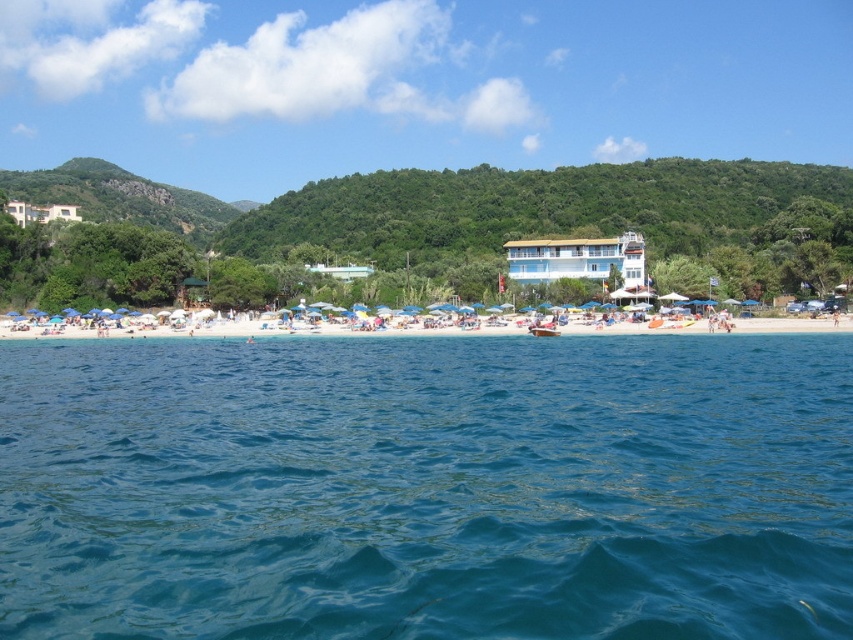
Is blue liquid water at center shorter than white glossy building at upper left?

Yes.

How much distance is there between blue liquid water at center and white glossy building at upper left?

A distance of 83.08 meters exists between blue liquid water at center and white glossy building at upper left.

The image size is (853, 640). In order to click on blue liquid water at center in this screenshot , I will do `click(426, 486)`.

Is the position of white glossy building at center less distant than that of wooden boat at center?

No, white glossy building at center is behind wooden boat at center.

Can you confirm if white glossy building at center is shorter than wooden boat at center?

No, white glossy building at center is not shorter than wooden boat at center.

The image size is (853, 640). I want to click on white glossy building at center, so click(x=579, y=260).

Does white sand beach at center lie in front of white glossy building at center?

Yes.

Who is more forward, (158, 336) or (585, 275)?

Point (158, 336) is in front.

Identify the location of white sand beach at center. (793, 324).